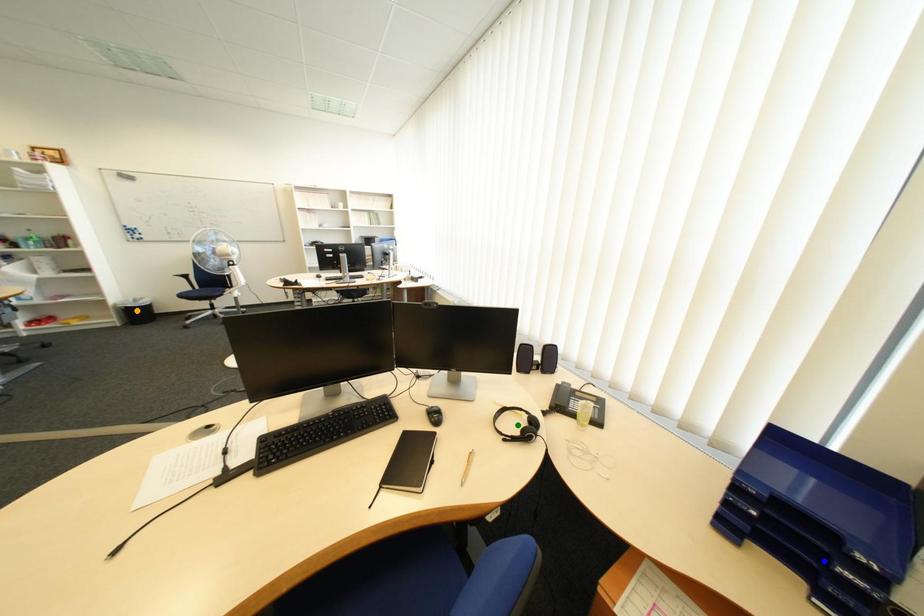
Order these from nearest to farthest:
1. green point
2. blue point
3. orange point

orange point
green point
blue point